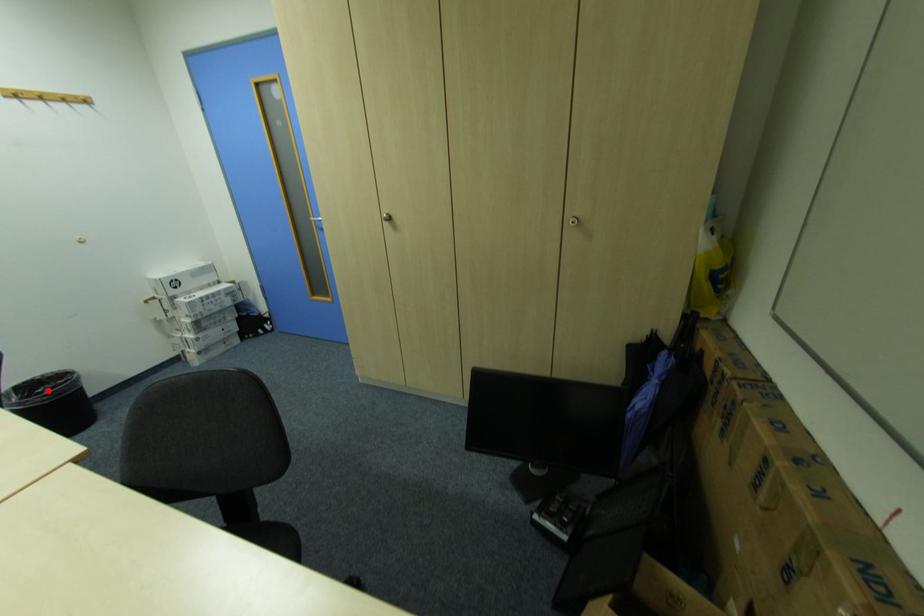
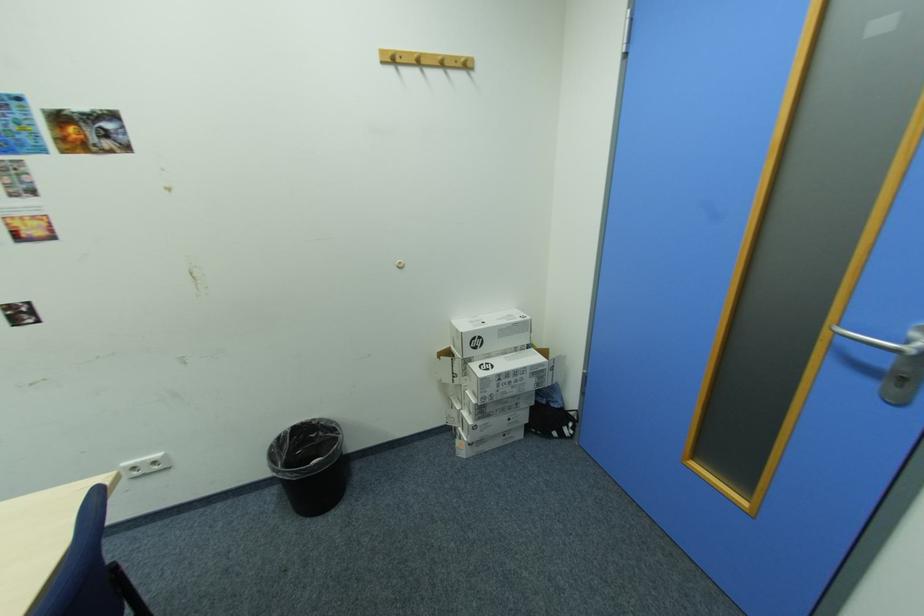
In the second image, find the point that corresponds to the highlighted location in the first image.

(322, 436)